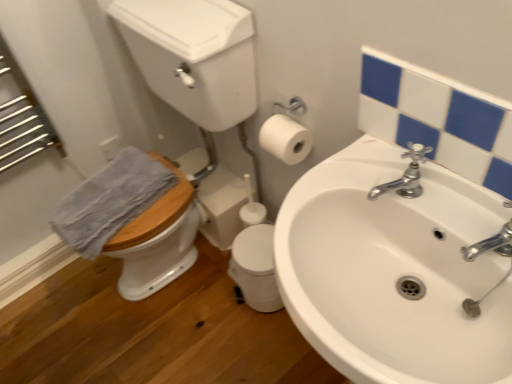
At what (x,y) coordinates should I click in order to perform the action: click on free space to the left of silver metallic faucet at upper right. Please return your answer as a coordinate pair (x, y). Looking at the image, I should click on (320, 200).